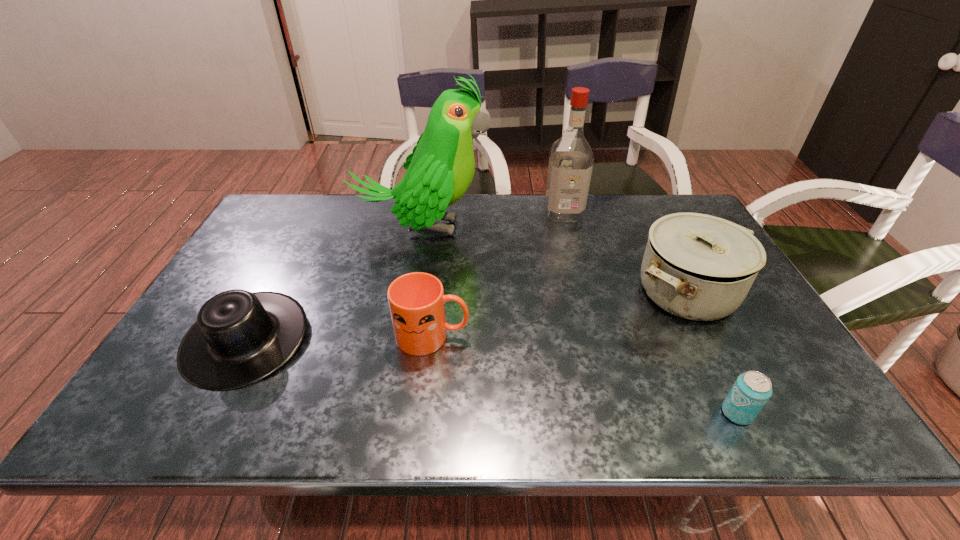
Image resolution: width=960 pixels, height=540 pixels. In the image, there is a desktop. What are the coordinates of `free space at the far edge` in the screenshot? It's located at (513, 214).

In the image, there is a desktop. Identify the location of vacant space at the near edge. (655, 408).

Image resolution: width=960 pixels, height=540 pixels. In the image, there is a desktop. Find the location of `vacant space at the left edge`. vacant space at the left edge is located at coordinates (x=249, y=273).

At what (x,y) coordinates should I click in order to perform the action: click on free space at the far left corner of the desktop. Please return your answer as a coordinate pair (x, y). Image resolution: width=960 pixels, height=540 pixels. Looking at the image, I should click on (259, 222).

The image size is (960, 540). I want to click on vacant space at the near right corner of the desktop, so click(x=808, y=403).

Where is `vacant area that lies between the saucepan and the parakeet`? vacant area that lies between the saucepan and the parakeet is located at coordinates (554, 260).

Identify the location of empty space that is in between the dress hat and the third shortest object. The height and width of the screenshot is (540, 960). (339, 338).

Where is `free space between the fourth tallest object and the beer can`? free space between the fourth tallest object and the beer can is located at coordinates (585, 374).

Image resolution: width=960 pixels, height=540 pixels. Find the location of `free space between the nearest object and the mug`. free space between the nearest object and the mug is located at coordinates (585, 374).

At what (x,y) coordinates should I click in order to perform the action: click on vacant space in between the third shortest object and the beer can. Please return your answer as a coordinate pair (x, y). This screenshot has width=960, height=540. Looking at the image, I should click on (585, 374).